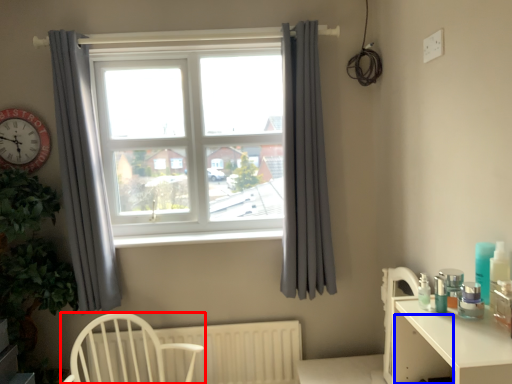
Question: Which object appears farthest to the camera in this image, chair (highlighted by a red box) or drawer (highlighted by a blue box)?

Choices:
 (A) chair
 (B) drawer

Answer: (A)